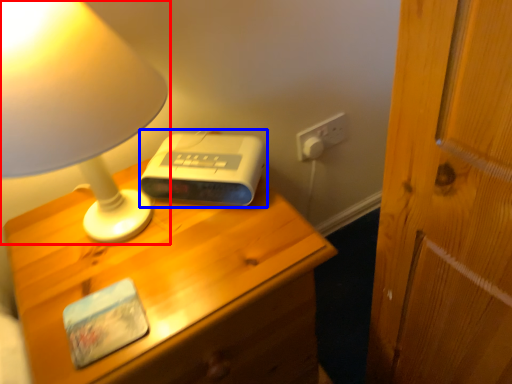
Question: Which point is further to the camera, lamp (highlighted by a red box) or gadget (highlighted by a blue box)?

Choices:
 (A) lamp
 (B) gadget

Answer: (B)